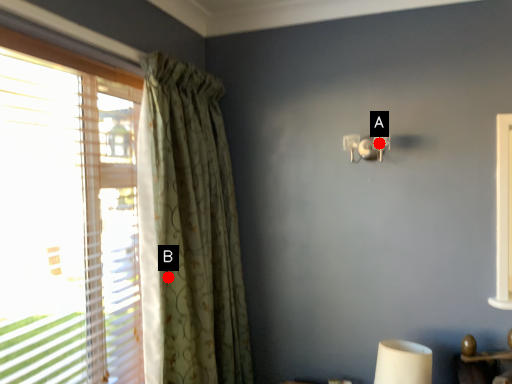
Question: Two points are circled on the image, labeled by A and B beside each circle. Which point is closer to the camera taking this photo?

Choices:
 (A) A is closer
 (B) B is closer

Answer: (B)